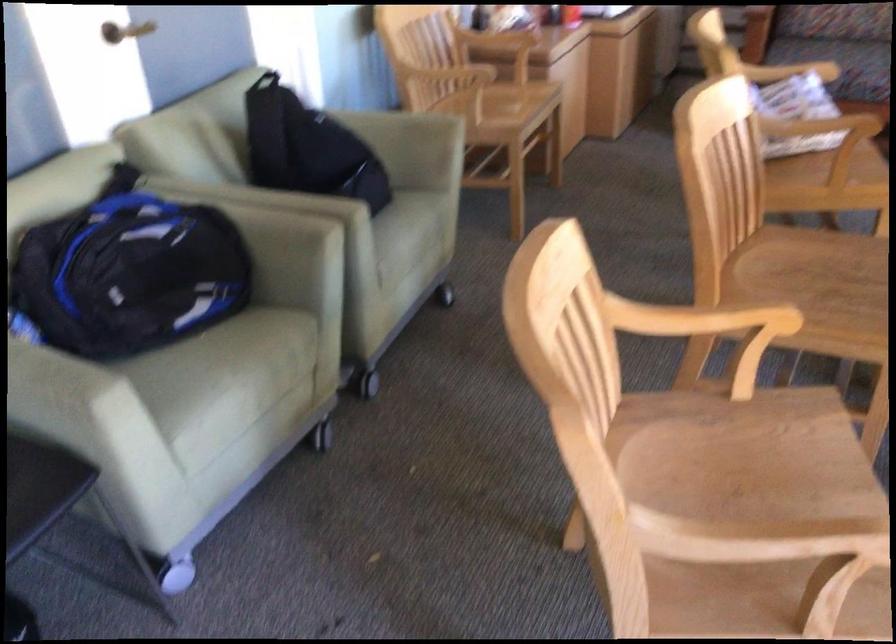
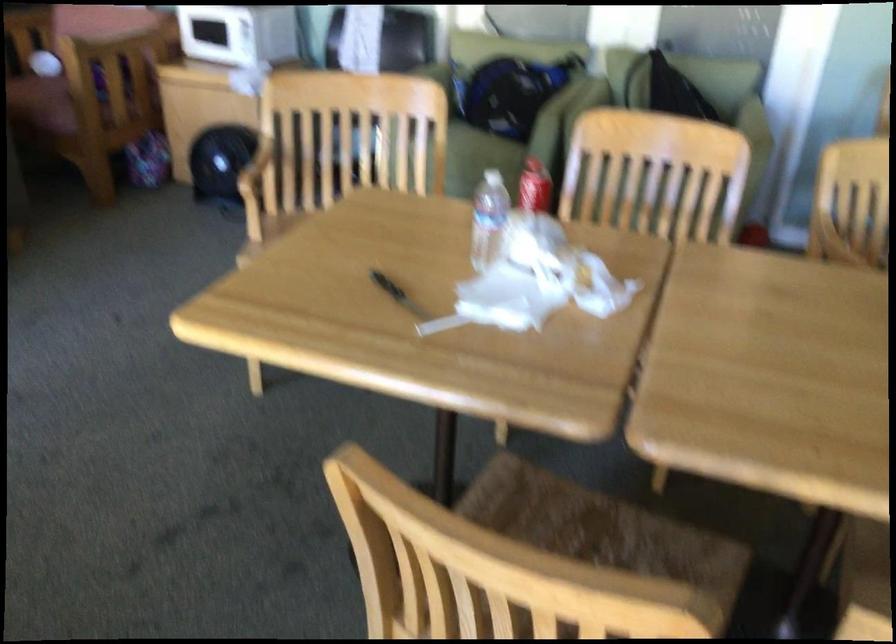
Question: I am providing you with two images of the same scene from different viewpoints. Please identify which objects are invisible in image2.

Choices:
 (A) black handle knife
 (B) plastic water bottle
 (C) caster wheel
 (D) purple marker

Answer: (C)